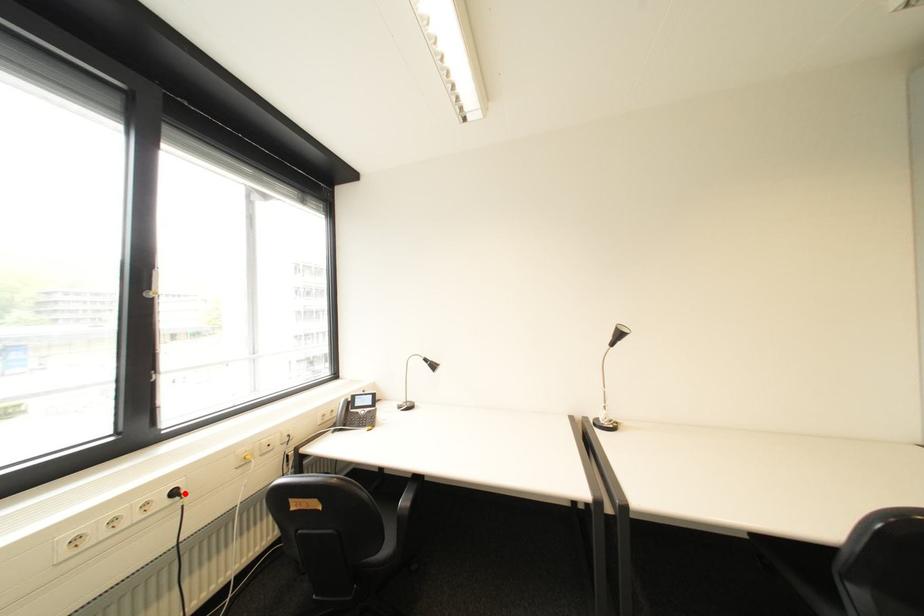
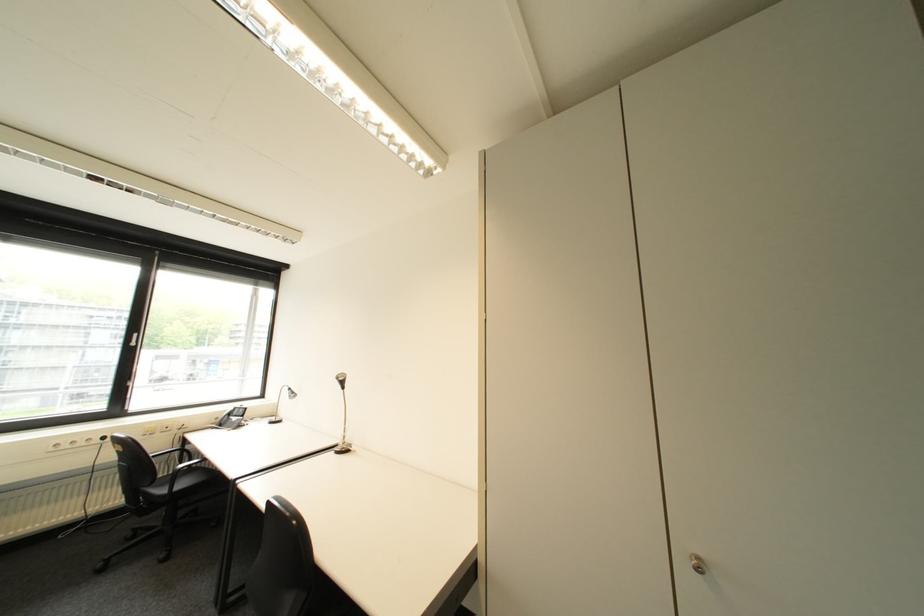
Find the pixel in the second image that matches the highlighted location in the first image.

(114, 439)